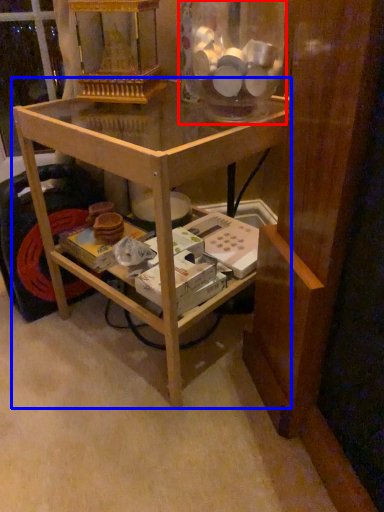
Question: Among these objects, which one is nearest to the camera, glass jar (highlighted by a red box) or table (highlighted by a blue box)?

Choices:
 (A) glass jar
 (B) table

Answer: (B)